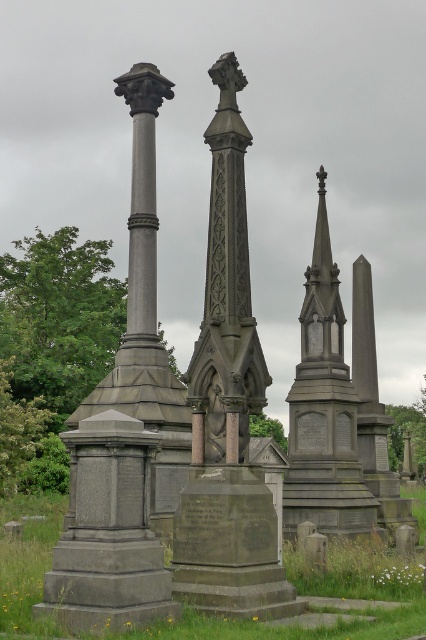
Based on the photo, does gray stone monument at center lie in front of polished stone spire at center?

That is True.

Can you confirm if gray stone monument at center is positioned above polished stone spire at center?

Yes.

The height and width of the screenshot is (640, 426). Describe the element at coordinates (227, 406) in the screenshot. I see `gray stone monument at center` at that location.

You are a GUI agent. You are given a task and a screenshot of the screen. Output one action in this format:
    pyautogui.click(x=<x>, y=<y>)
    Task: Click on the gray stone monument at center
    
    Given the screenshot: What is the action you would take?
    pyautogui.click(x=227, y=406)